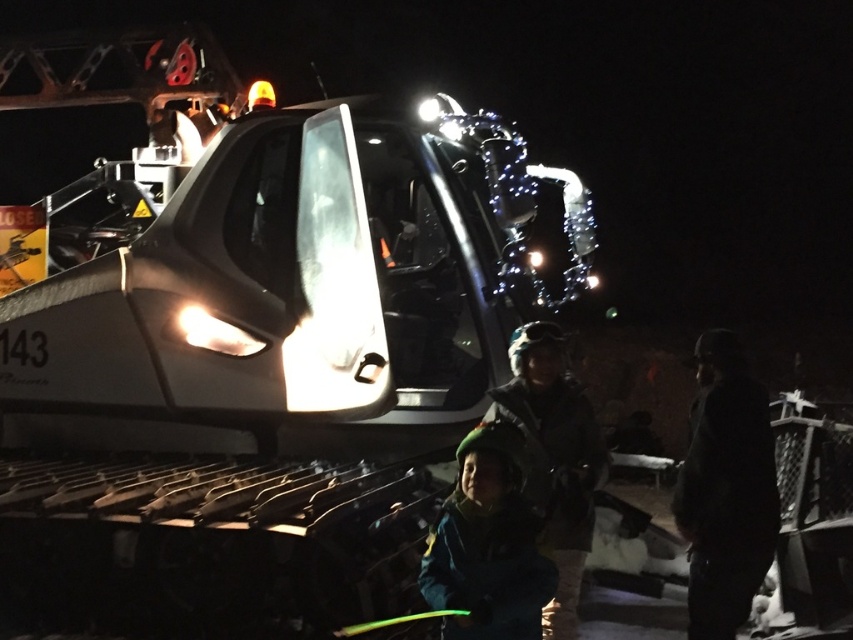
You are standing next to the snowcat and want to hand the green fuzzy hat at lower center to the person wearing the metallic silver tank at center. Which direction should you move to ensure they can easily receive it?

You should move towards the metallic silver tank at center because it is closer to you than the green fuzzy hat at lower center, so handing it there would be easier.

You are a winter hiker who just found a metallic silver tank at center and a green fuzzy hat at lower center near a snowcat. Which item is closer to the left edge of the scene?

The metallic silver tank at center is closer to the left edge of the scene because it is positioned on the left side of the green fuzzy hat at lower center.

You are planning to take a photo of the dark woolen hat at center and the green fuzzy hat at lower center. Which hat should you focus on first if you want to capture both in a single frame without moving the camera?

You should focus on the dark woolen hat at center first because it is larger in size compared to the green fuzzy hat at lower center, allowing you to position it appropriately while still fitting the smaller green fuzzy hat at lower center into the frame.